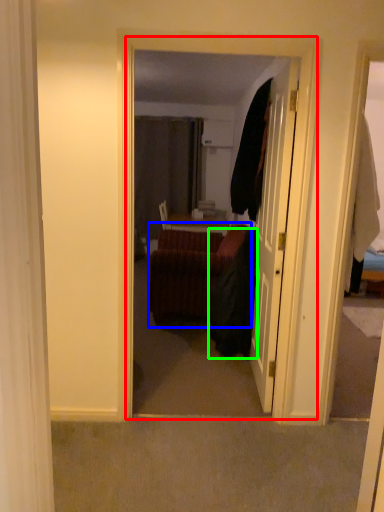
Question: Based on their relative distances, which object is farther from corridor (highlighted by a red box)? Choose from studio couch (highlighted by a blue box) and robe (highlighted by a green box).

Choices:
 (A) studio couch
 (B) robe

Answer: (A)